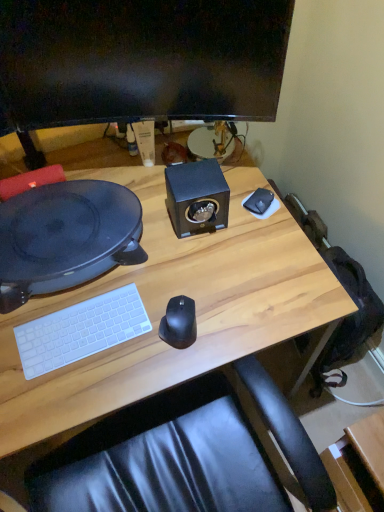
Question: From a real-world perspective, is matte black monitor at upper center positioned under black plastic record player at left based on gravity?

Choices:
 (A) yes
 (B) no

Answer: (B)

Question: Considering the relative sizes of matte black monitor at upper center and black plastic record player at left in the image provided, is matte black monitor at upper center bigger than black plastic record player at left?

Choices:
 (A) no
 (B) yes

Answer: (A)

Question: From the image's perspective, is matte black monitor at upper center located above black plastic record player at left?

Choices:
 (A) no
 (B) yes

Answer: (B)

Question: Is matte black monitor at upper center at the right side of black plastic record player at left?

Choices:
 (A) yes
 (B) no

Answer: (A)

Question: Is matte black monitor at upper center oriented away from black plastic record player at left?

Choices:
 (A) no
 (B) yes

Answer: (A)

Question: Is the surface of matte black monitor at upper center in direct contact with black plastic record player at left?

Choices:
 (A) yes
 (B) no

Answer: (B)

Question: Is white matte keyboard at lower left facing away from wooden desk at center?

Choices:
 (A) no
 (B) yes

Answer: (A)

Question: From the image's perspective, is white matte keyboard at lower left located beneath wooden desk at center?

Choices:
 (A) yes
 (B) no

Answer: (B)

Question: Could you tell me if white matte keyboard at lower left is facing wooden desk at center?

Choices:
 (A) yes
 (B) no

Answer: (B)

Question: From a real-world perspective, is white matte keyboard at lower left located beneath wooden desk at center?

Choices:
 (A) yes
 (B) no

Answer: (B)

Question: Can you confirm if white matte keyboard at lower left is bigger than wooden desk at center?

Choices:
 (A) yes
 (B) no

Answer: (B)

Question: From a real-world perspective, is white matte keyboard at lower left physically above wooden desk at center?

Choices:
 (A) no
 (B) yes

Answer: (B)

Question: Considering the relative sizes of black plastic record player at left and white matte mousepad at upper right in the image provided, is black plastic record player at left shorter than white matte mousepad at upper right?

Choices:
 (A) yes
 (B) no

Answer: (B)